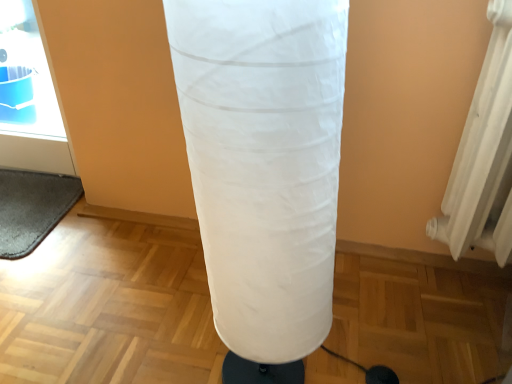
Question: Based on their positions, is gray fuzzy yoga mat at lower left located to the left or right of white fabric punching bag at center?

Choices:
 (A) right
 (B) left

Answer: (B)

Question: From the image's perspective, relative to white fabric punching bag at center, is gray fuzzy yoga mat at lower left above or below?

Choices:
 (A) above
 (B) below

Answer: (A)

Question: Considering the positions of gray fuzzy yoga mat at lower left and white fabric punching bag at center in the image, is gray fuzzy yoga mat at lower left taller or shorter than white fabric punching bag at center?

Choices:
 (A) short
 (B) tall

Answer: (A)

Question: Is white fabric punching bag at center inside or outside of gray fuzzy yoga mat at lower left?

Choices:
 (A) outside
 (B) inside

Answer: (A)

Question: From the image's perspective, is white fabric punching bag at center positioned above or below gray fuzzy yoga mat at lower left?

Choices:
 (A) above
 (B) below

Answer: (B)

Question: Visually, is white fabric punching bag at center positioned to the left or to the right of gray fuzzy yoga mat at lower left?

Choices:
 (A) left
 (B) right

Answer: (B)

Question: Is white fabric punching bag at center wider or thinner than gray fuzzy yoga mat at lower left?

Choices:
 (A) wide
 (B) thin

Answer: (B)